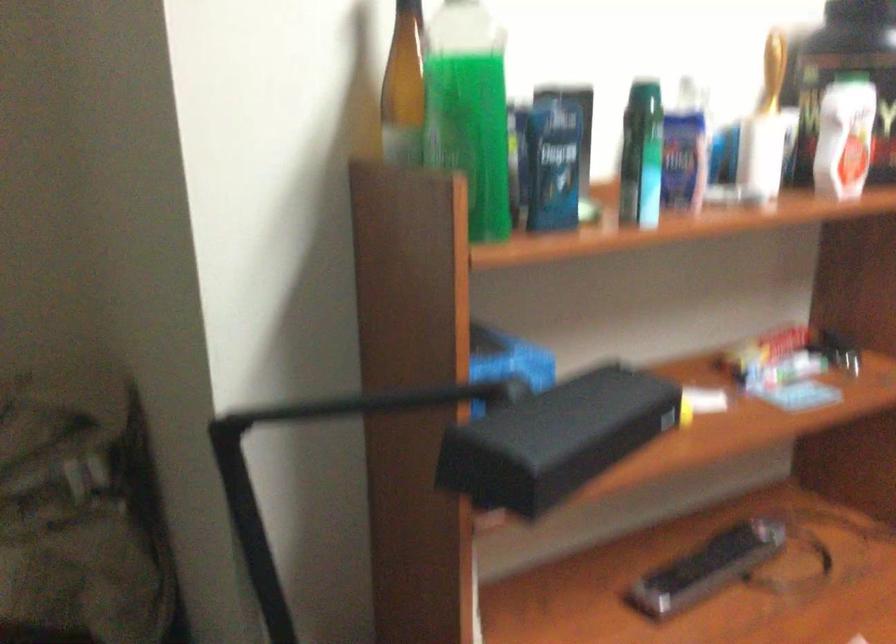
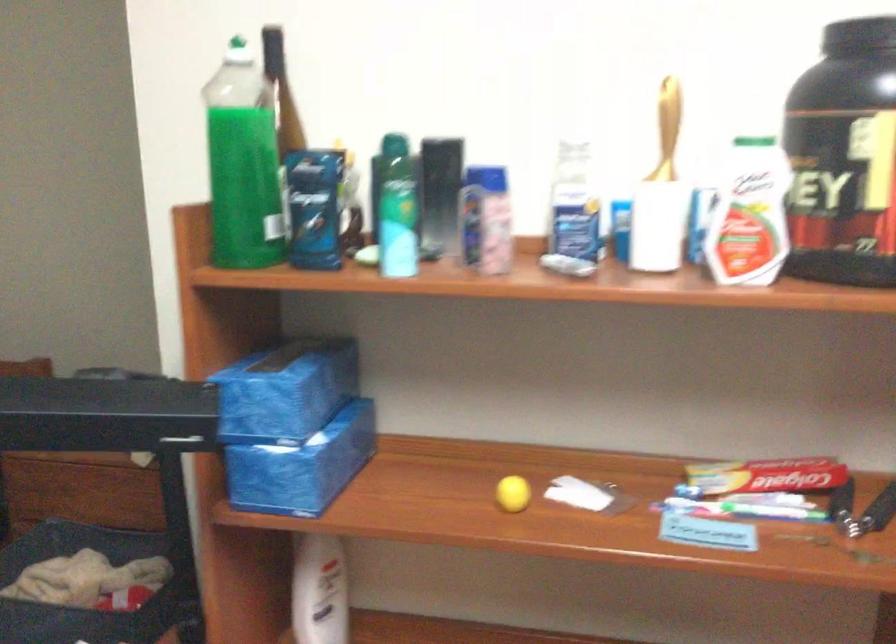
The point at (768,351) is marked in the first image. Where is the corresponding point in the second image?

(764, 483)